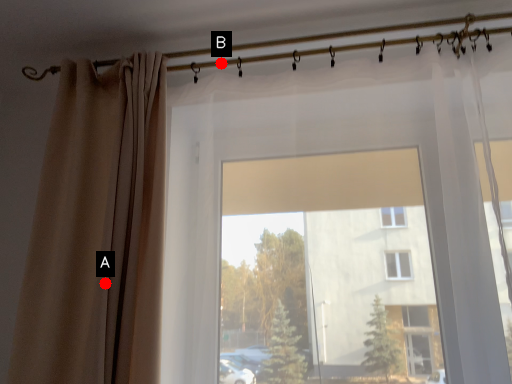
Question: Two points are circled on the image, labeled by A and B beside each circle. Which point is further to the camera?

Choices:
 (A) A is further
 (B) B is further

Answer: (B)